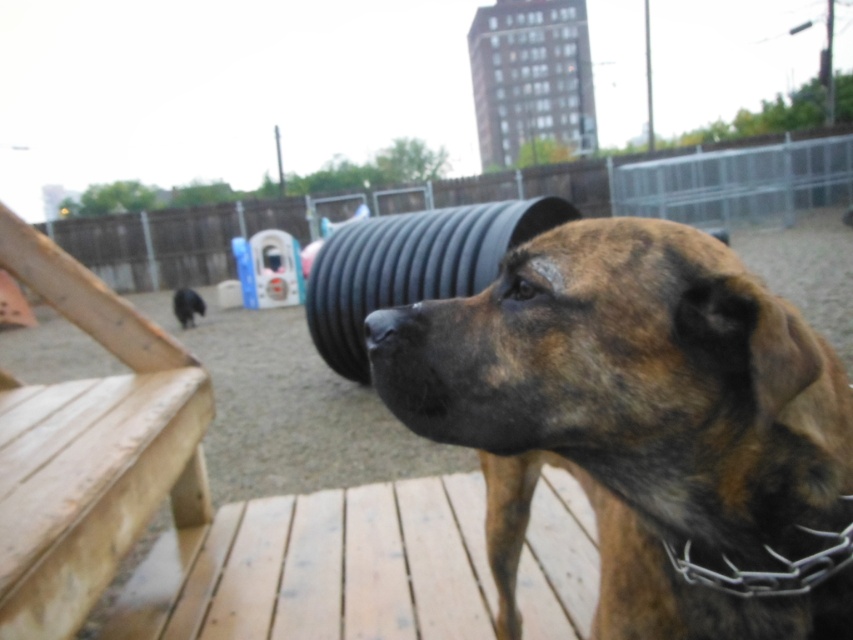
You are taking a photo of the dog park scene. You notice two points in the image labeled as point 1 at coordinates point (787, 499) and point 2 at coordinates point (358, 257). Which point is closer to your camera lens?

Point (787, 499) is closer to the camera lens than point (358, 257).

You are a dog owner who wants to ensure your pet stays within a 10 meter safety zone. You see the brindle fur dog at center and the brown brindle dog at center. Can you determine if both dogs are within the 10 meter safety zone?

The brindle fur dog at center is 11.53 meters away from brown brindle dog at center. Since the distance between them exceeds 10 meters, at least one of the dogs is outside the 10 meter safety zone.